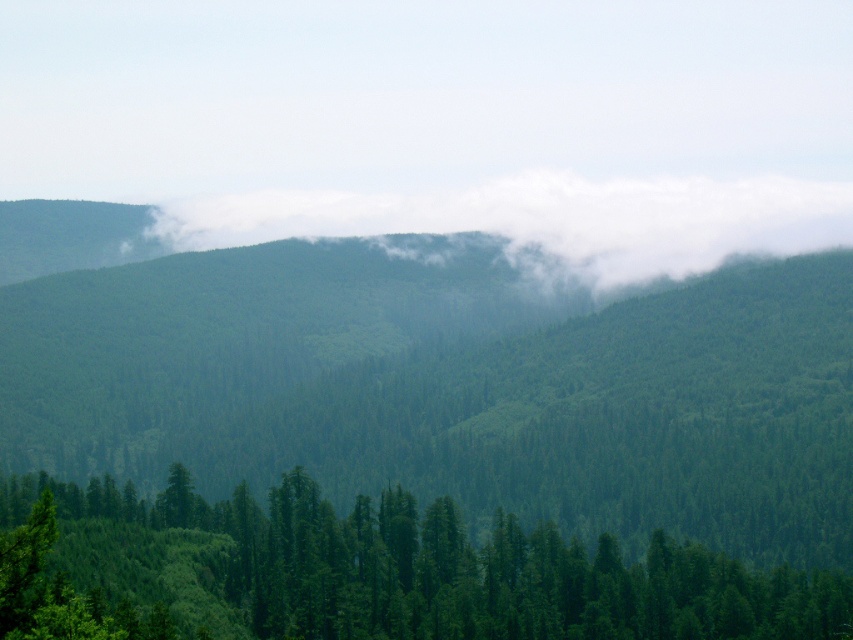
Who is positioned more to the left, green matte tree at lower left or white fluffy cloud at center?

From the viewer's perspective, green matte tree at lower left appears more on the left side.

Which of these two, green matte tree at lower left or white fluffy cloud at center, stands shorter?

Standing shorter between the two is green matte tree at lower left.

Is point (363, 627) positioned behind point (448, 198)?

No, (363, 627) is closer to viewer.

The height and width of the screenshot is (640, 853). What are the coordinates of `green matte tree at lower left` in the screenshot? It's located at (367, 572).